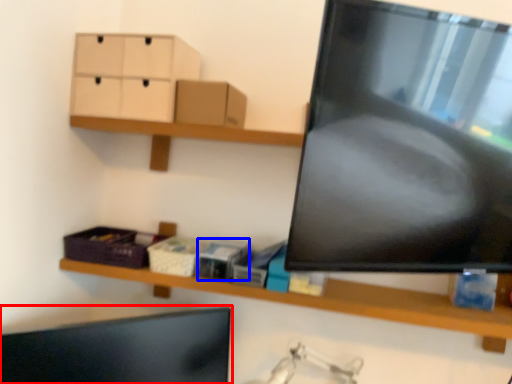
Question: Which object appears closest to the camera in this image, computer monitor (highlighted by a red box) or storage box (highlighted by a blue box)?

Choices:
 (A) computer monitor
 (B) storage box

Answer: (A)